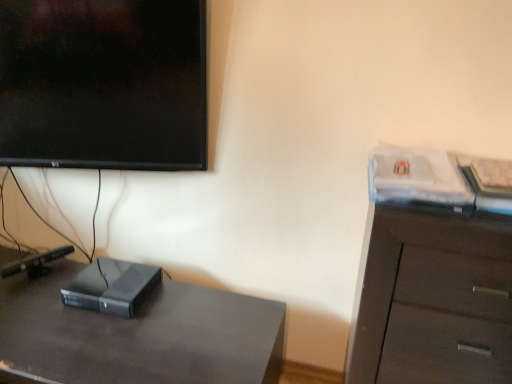
Where is `vacant space to the left of black matte computer at lower left`? The image size is (512, 384). vacant space to the left of black matte computer at lower left is located at coordinates (39, 300).